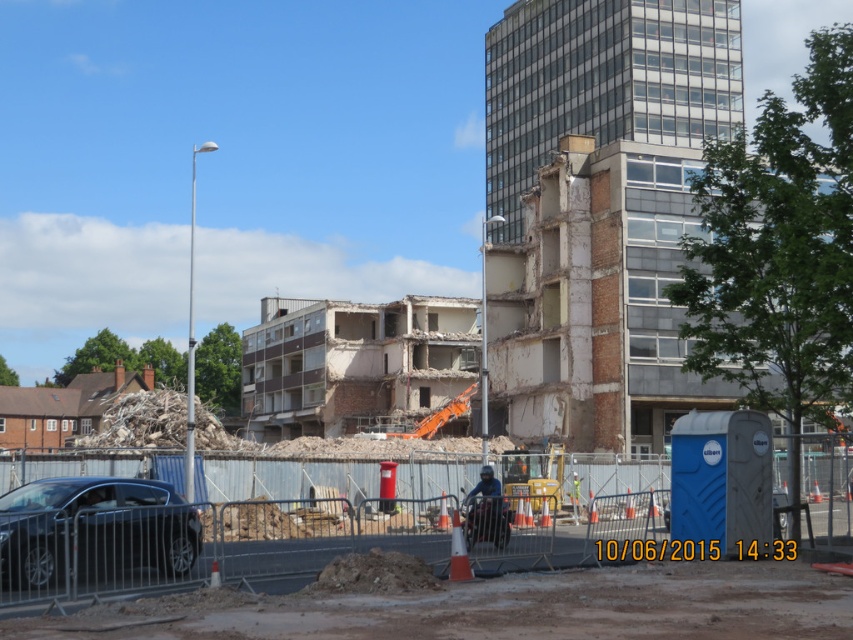
You are a safety inspector at the construction site. You need to ensure that the blue plastic website at center and the blue fabric construction worker at center are visible to each other for communication. Is there any obstruction between them?

The blue plastic website at center is smaller than the blue fabric construction worker at center, so there is no obstruction between them. They can see each other.

You are a delivery driver who needs to park your truck in the construction site. Your truck is 5 meters long. Is there enough space between the shiny black sedan at lower left and the blue fabric construction worker at center to park your truck?

The distance between the shiny black sedan at lower left and the blue fabric construction worker at center is 4.99 meters. Since the truck is 5 meters long, there is not enough space to park between them.

Looking at this image, you are standing at the construction site and want to reach a specific point marked at coordinates point (x=39, y=516). If you can walk 15 meters in a straight line, will you be able to reach that point?

The distance of point (x=39, y=516) from camera is 14.65 meters, so yes, you can reach it since it is within your 15 meters walking range.